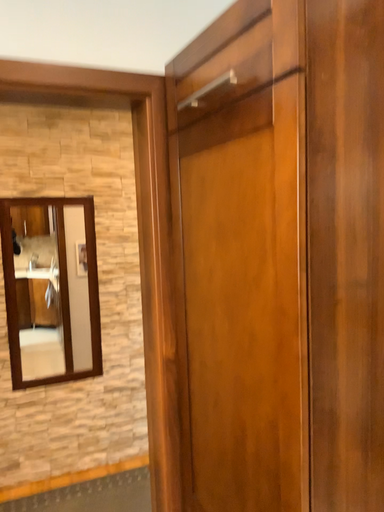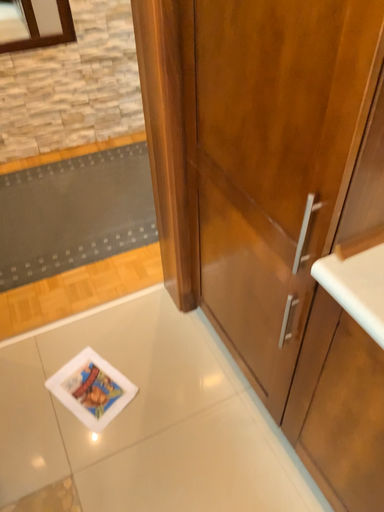
Question: Which way did the camera rotate in the video?

Choices:
 (A) rotated upward
 (B) rotated downward

Answer: (B)